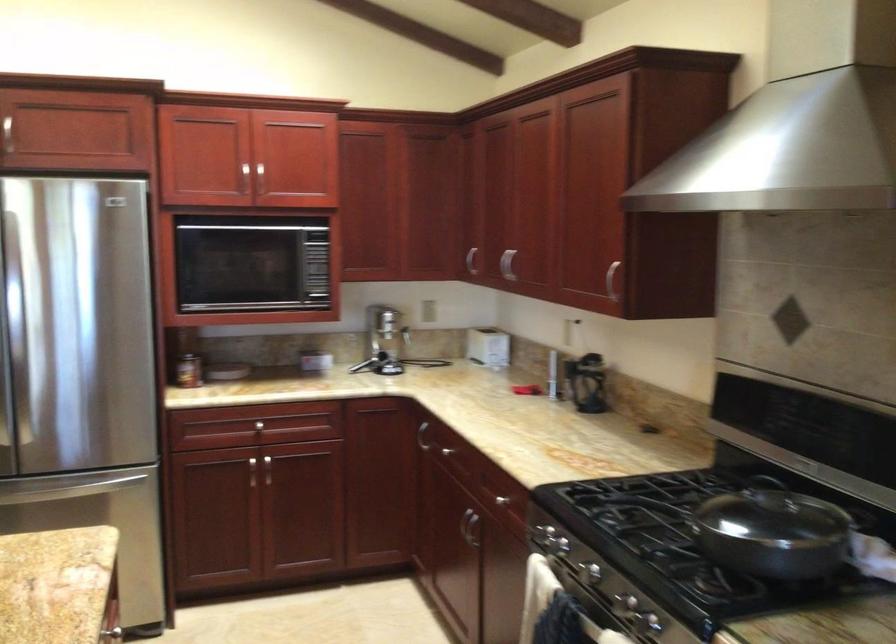
Where is `faucet lever handle`? This screenshot has width=896, height=644. faucet lever handle is located at coordinates (589, 573).